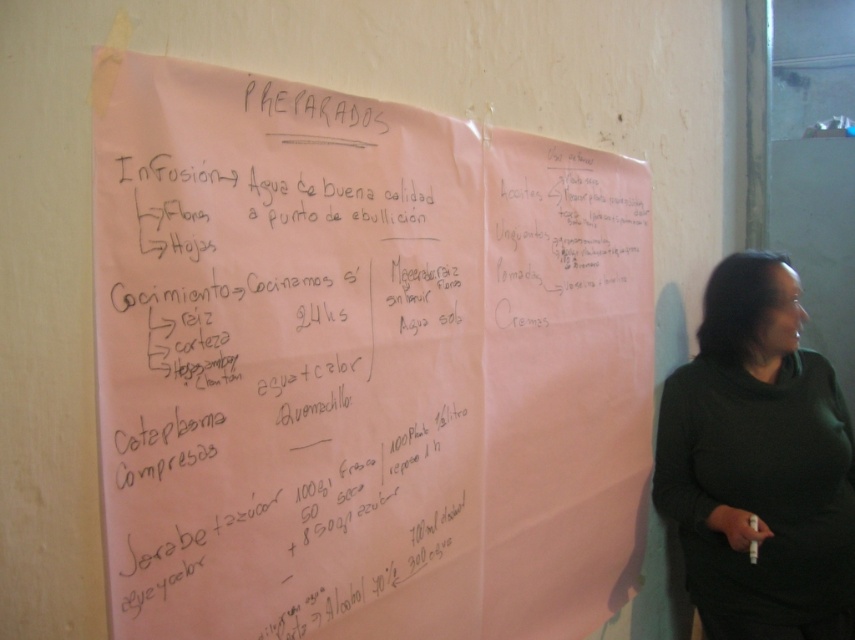
Based on the photo, what is the location of the point marked at coordinates (363, 365) on the wall with two large pink papers?

The point marked at coordinates (363, 365) is located on the pink paper at upper center.

You are an observer standing in front of the wall with the pink papers. You notice the pink paper at upper center and the black sweater at right. Which object is taller?

The pink paper at upper center is taller than the black sweater at right.